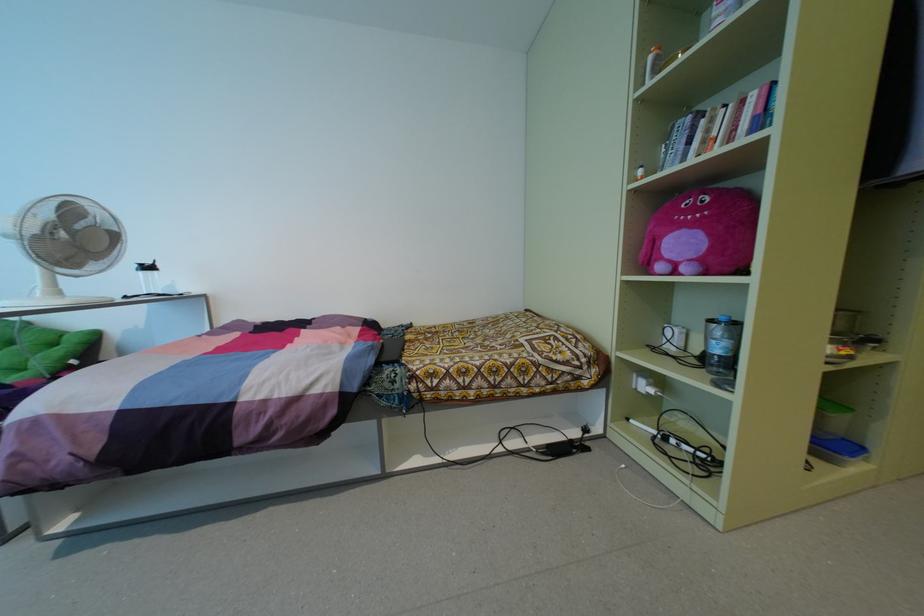
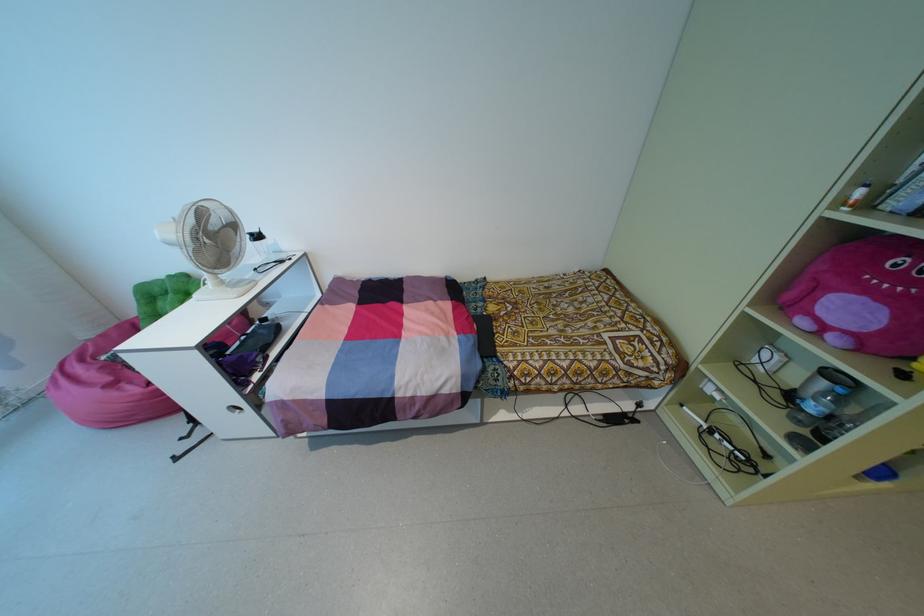
Question: Which direction would the cameraman need to move to produce the second image? Reply with the corresponding letter.

Choices:
 (A) Left
 (B) Right
 (C) Forward
 (D) Backward

Answer: (A)